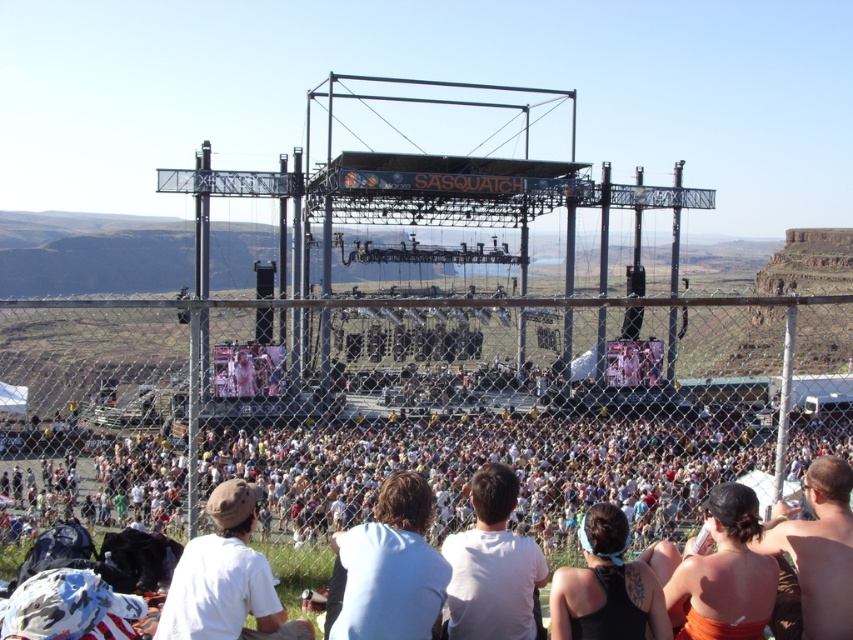
Question: Considering the real-world distances, which object is closest to the white cotton crowd at lower center?

Choices:
 (A) black matte tank top at center
 (B) white cotton shirt at lower center
 (C) white matte shirt at center
 (D) skinny bikini top at lower right

Answer: (B)

Question: Based on their relative distances, which object is nearer to the black matte tank top at center?

Choices:
 (A) white matte shirt at center
 (B) white cotton shirt at center
 (C) white cotton crowd at lower center

Answer: (A)

Question: Estimate the real-world distances between objects in this image. Which object is farther from the orange fabric top at lower right?

Choices:
 (A) white cotton crowd at lower center
 (B) skinny bikini top at lower right

Answer: (A)

Question: Observing the image, what is the correct spatial positioning of white cotton crowd at lower center in reference to orange fabric top at lower right?

Choices:
 (A) left
 (B) right

Answer: (A)

Question: Considering the relative positions of white cotton shirt at lower center and skinny bikini top at lower right in the image provided, where is white cotton shirt at lower center located with respect to skinny bikini top at lower right?

Choices:
 (A) below
 (B) above

Answer: (A)

Question: Is white cotton shirt at center behind skinny bikini top at lower right?

Choices:
 (A) yes
 (B) no

Answer: (B)